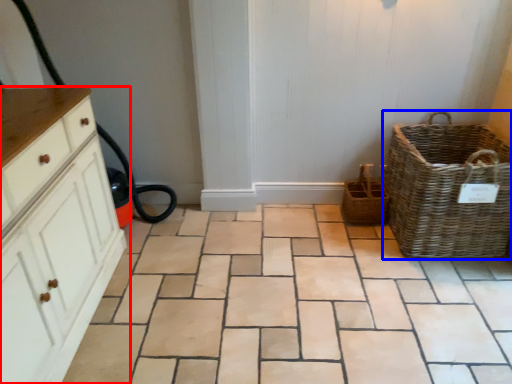
Question: Which point is closer to the camera, chest of drawers (highlighted by a red box) or picnic basket (highlighted by a blue box)?

Choices:
 (A) chest of drawers
 (B) picnic basket

Answer: (A)